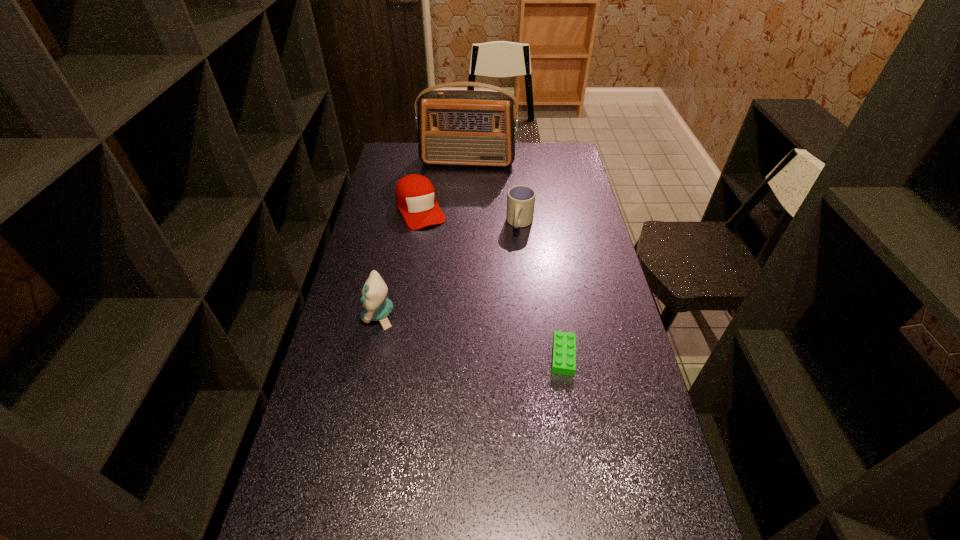
The image size is (960, 540). I want to click on free space located 0.180m on the front-facing side of the baseball cap, so click(444, 258).

You are a GUI agent. You are given a task and a screenshot of the screen. Output one action in this format:
    pyautogui.click(x=<x>, y=<y>)
    Task: Click on the blank area located on the front-facing side of the baseball cap
    
    Given the screenshot: What is the action you would take?
    pyautogui.click(x=437, y=246)

Where is `vacant space located 0.390m on the front-facing side of the baseball cap`? vacant space located 0.390m on the front-facing side of the baseball cap is located at coordinates (464, 298).

The image size is (960, 540). Find the location of `free space located 0.270m on the front-facing side of the tallest object`. free space located 0.270m on the front-facing side of the tallest object is located at coordinates (459, 206).

Identify the location of vacant space located 0.390m on the front-facing side of the tallest object. Image resolution: width=960 pixels, height=540 pixels. (456, 224).

What are the coordinates of `free space located on the front-facing side of the tallest object` in the screenshot? It's located at (459, 206).

This screenshot has width=960, height=540. In order to click on free region located with the handle on the side of the cup in this screenshot , I will do `click(507, 260)`.

Where is `vacant space situated with the handle on the side of the cup`? vacant space situated with the handle on the side of the cup is located at coordinates (504, 268).

I want to click on vacant area located 0.220m with the handle on the side of the cup, so click(502, 273).

In order to click on object that is at the far edge in this screenshot , I will do `click(455, 127)`.